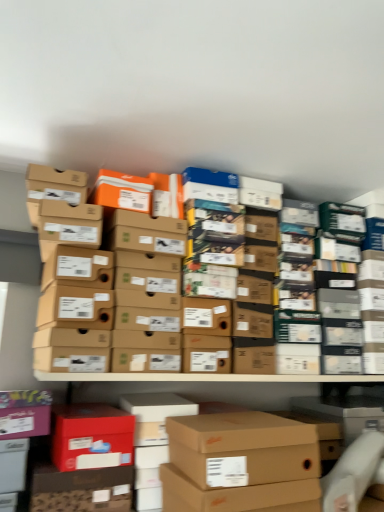
Identify the location of vacant area on top of matte cardboard box at center (from a real-world perspective). (226, 426).